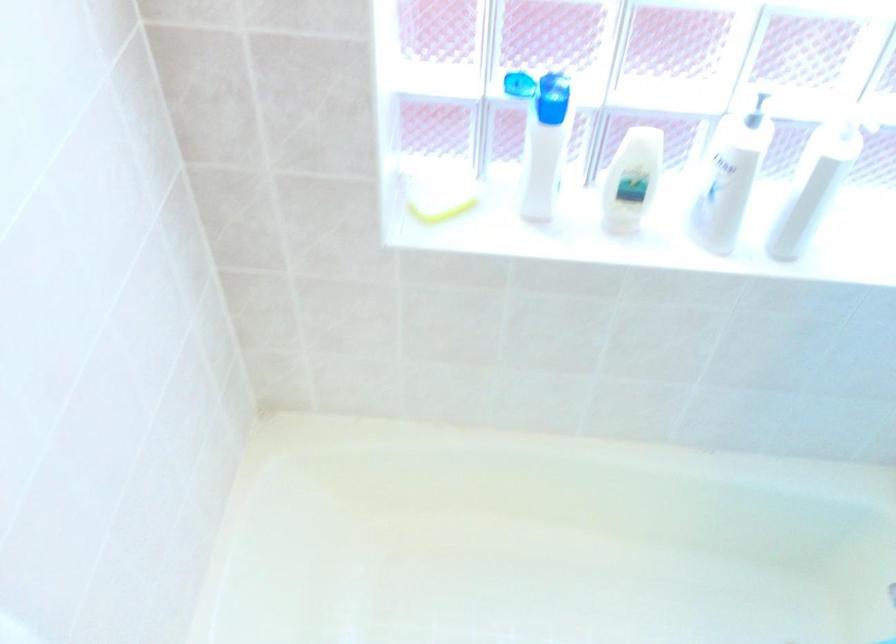
Identify the location of blue bottle cap. Image resolution: width=896 pixels, height=644 pixels. (537, 88).